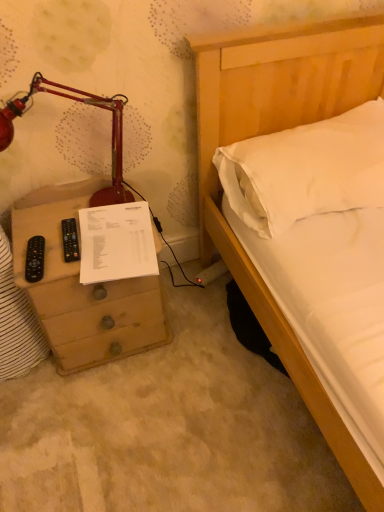
Question: Is wooden chest of drawers at left outside black plastic remote at left?

Choices:
 (A) no
 (B) yes

Answer: (B)

Question: From a real-world perspective, does wooden chest of drawers at left sit lower than black plastic remote at left?

Choices:
 (A) no
 (B) yes

Answer: (B)

Question: Can you confirm if wooden chest of drawers at left is smaller than black plastic remote at left?

Choices:
 (A) no
 (B) yes

Answer: (A)

Question: Does wooden chest of drawers at left have a lesser height compared to black plastic remote at left?

Choices:
 (A) no
 (B) yes

Answer: (A)

Question: Is wooden chest of drawers at left to the left of black plastic remote at left from the viewer's perspective?

Choices:
 (A) yes
 (B) no

Answer: (B)

Question: Is black plastic remote at left taller or shorter than white paper at left?

Choices:
 (A) tall
 (B) short

Answer: (B)

Question: Considering the positions of black plastic remote at left and white paper at left in the image, is black plastic remote at left wider or thinner than white paper at left?

Choices:
 (A) thin
 (B) wide

Answer: (A)

Question: Is point (31, 240) positioned closer to the camera than point (102, 268)?

Choices:
 (A) closer
 (B) farther

Answer: (B)

Question: From a real-world perspective, is black plastic remote at left above or below white paper at left?

Choices:
 (A) below
 (B) above

Answer: (B)

Question: Is point (241, 150) positioned closer to the camera than point (82, 275)?

Choices:
 (A) farther
 (B) closer

Answer: (A)

Question: From the image's perspective, is white soft pillow at upper right above or below white paper at left?

Choices:
 (A) above
 (B) below

Answer: (A)

Question: Do you think white soft pillow at upper right is within white paper at left, or outside of it?

Choices:
 (A) inside
 (B) outside

Answer: (B)

Question: Visually, is white soft pillow at upper right positioned to the left or to the right of white paper at left?

Choices:
 (A) left
 (B) right

Answer: (B)

Question: From a real-world perspective, is white soft pillow at upper right above or below black plastic remote at left?

Choices:
 (A) below
 (B) above

Answer: (B)

Question: Relative to black plastic remote at left, is white soft pillow at upper right in front or behind?

Choices:
 (A) behind
 (B) front

Answer: (B)